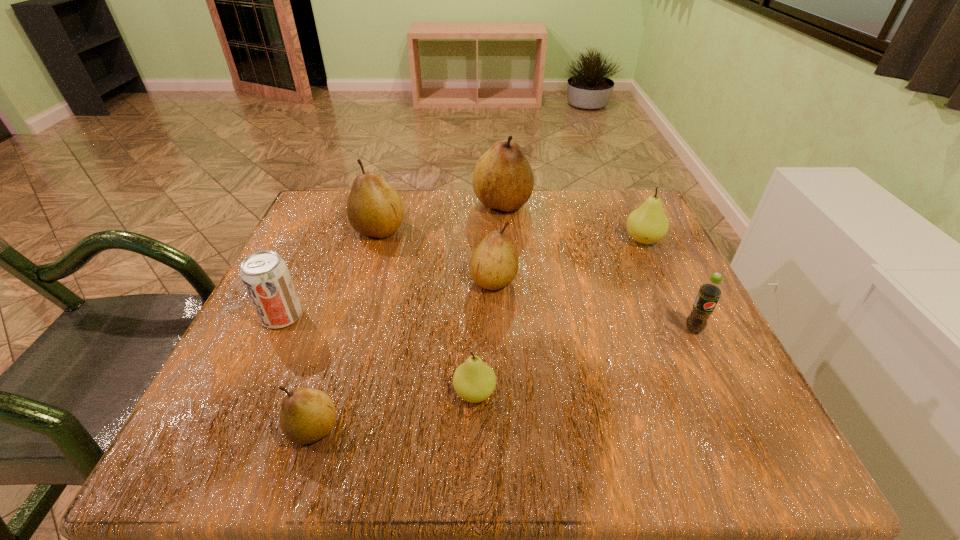
This screenshot has height=540, width=960. I want to click on the nearest brown pear, so click(x=306, y=415).

Find the location of `the left green pear`. the left green pear is located at coordinates (474, 381).

What are the coordinates of `the smaller green pear` in the screenshot? It's located at (474, 381).

Find the location of a particular element. free region located 0.270m on the left of the biggest brown pear is located at coordinates (366, 204).

The image size is (960, 540). In order to click on free region located 0.070m on the back of the seventh shortest object in this screenshot , I will do `click(388, 200)`.

Identify the location of vacant area situated 0.370m on the front of the right green pear. (717, 399).

At what (x,y) coordinates should I click in order to perform the action: click on free space located 0.120m on the back of the second nearest brown pear. Please return your answer as a coordinate pair (x, y). The image size is (960, 540). Looking at the image, I should click on (492, 232).

In order to click on free spot located 0.390m on the right of the left soda in this screenshot , I will do `click(514, 316)`.

The height and width of the screenshot is (540, 960). Find the location of `free space located on the front label of the right soda`. free space located on the front label of the right soda is located at coordinates (749, 443).

The width and height of the screenshot is (960, 540). I want to click on free space located on the right of the smallest brown pear, so click(476, 429).